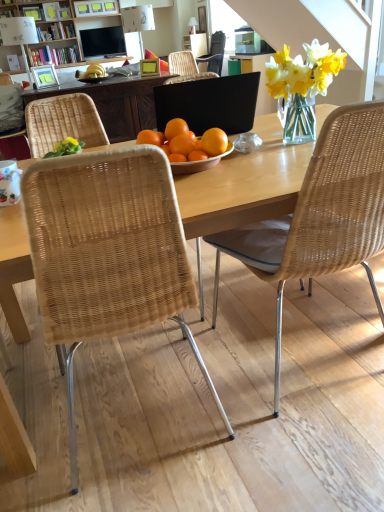
Question: Is black matte laptop at center at the right side of woven wicker chair at center, which appears as the 1th chair when viewed from the front?

Choices:
 (A) yes
 (B) no

Answer: (A)

Question: Is black matte laptop at center far from woven wicker chair at center, positioned as the 2th chair in left-to-right order?

Choices:
 (A) yes
 (B) no

Answer: (B)

Question: Is black matte laptop at center to the left of woven wicker chair at center, acting as the third chair starting from the back, from the viewer's perspective?

Choices:
 (A) no
 (B) yes

Answer: (A)

Question: From the image's perspective, is black matte laptop at center on woven wicker chair at center, which appears as the 1th chair when viewed from the front?

Choices:
 (A) no
 (B) yes

Answer: (B)

Question: Considering the relative sizes of black matte laptop at center and woven wicker chair at center, which ranks as the 2th chair in right-to-left order, in the image provided, is black matte laptop at center bigger than woven wicker chair at center, which ranks as the 2th chair in right-to-left order,?

Choices:
 (A) yes
 (B) no

Answer: (B)

Question: Considering the positions of point [x=102, y=35] and point [x=16, y=117], is point [x=102, y=35] closer or farther from the camera than point [x=16, y=117]?

Choices:
 (A) farther
 (B) closer

Answer: (A)

Question: Considering the relative positions of matte black television at upper center and woven rattan chair at left, the first chair when ordered from left to right, in the image provided, is matte black television at upper center to the left or to the right of woven rattan chair at left, the first chair when ordered from left to right,?

Choices:
 (A) right
 (B) left

Answer: (A)

Question: Is matte black television at upper center wider or thinner than woven rattan chair at left, placed as the 1th chair when sorted from back to front?

Choices:
 (A) thin
 (B) wide

Answer: (A)

Question: From a real-world perspective, relative to woven rattan chair at left, the third chair viewed from the right, is matte black television at upper center vertically above or below?

Choices:
 (A) below
 (B) above

Answer: (B)

Question: From a real-world perspective, is wooden bookcase at upper center physically located above or below matte green picture frame at upper center, the 2th picture frame positioned from the left?

Choices:
 (A) below
 (B) above

Answer: (B)

Question: Is wooden bookcase at upper center bigger or smaller than matte green picture frame at upper center, the 2th picture frame positioned from the left?

Choices:
 (A) small
 (B) big

Answer: (B)

Question: In the image, is wooden bookcase at upper center positioned in front of or behind matte green picture frame at upper center, positioned as the first picture frame in right-to-left order?

Choices:
 (A) front
 (B) behind

Answer: (B)

Question: Visually, is wooden bookcase at upper center positioned to the left or to the right of matte green picture frame at upper center, the 2th picture frame positioned from the left?

Choices:
 (A) left
 (B) right

Answer: (A)

Question: Considering the positions of woven wicker chair at center, the second chair positioned from the front, and matte wood picture frame at upper left, which ranks as the second picture frame in right-to-left order, in the image, is woven wicker chair at center, the second chair positioned from the front, wider or thinner than matte wood picture frame at upper left, which ranks as the second picture frame in right-to-left order,?

Choices:
 (A) thin
 (B) wide

Answer: (B)

Question: Based on their sizes in the image, would you say woven wicker chair at center, the 2th chair viewed from the back, is bigger or smaller than matte wood picture frame at upper left, which ranks as the second picture frame in right-to-left order?

Choices:
 (A) small
 (B) big

Answer: (B)